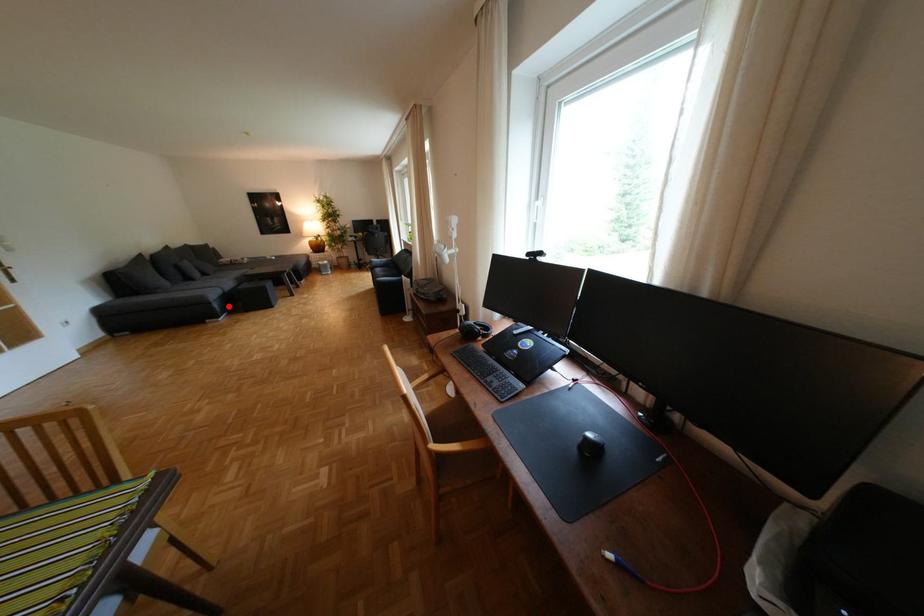
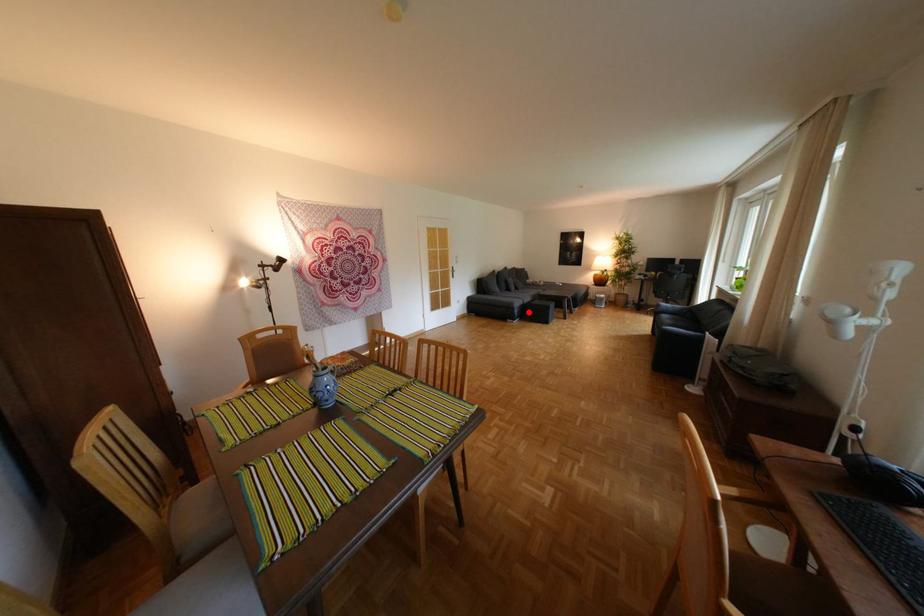
I am providing you with two images of the same scene from different viewpoints. A red point is marked on the first image and another point is marked on the second image. Is the marked point in image1 the same physical position as the marked point in image2?

Yes